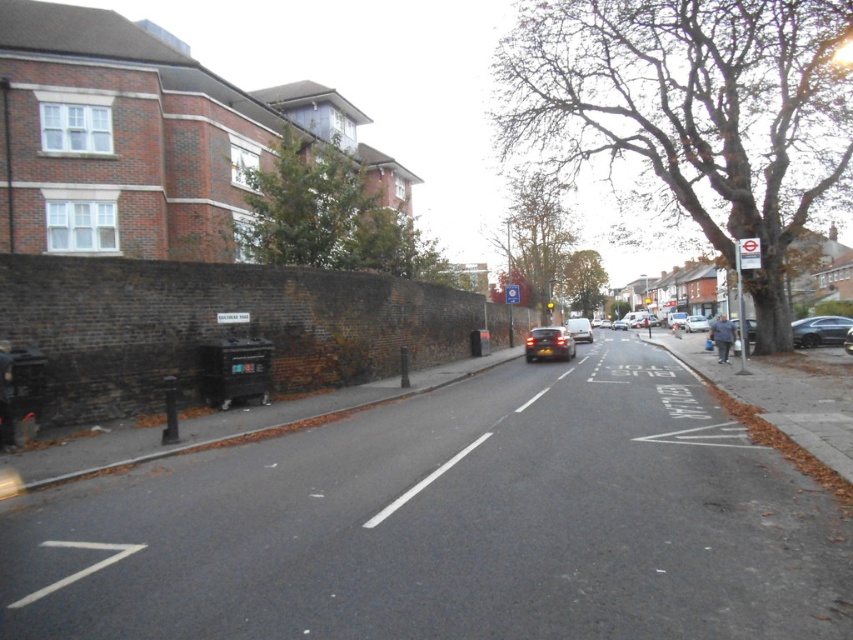
Question: Which of the following is the farthest from the observer?

Choices:
 (A) (697, 324)
 (B) (558, 355)
 (C) (830, 323)
 (D) (753, 260)

Answer: (A)

Question: Which point is farther to the camera?

Choices:
 (A) silver metallic van at center
 (B) metallic silver bus stop sign at right

Answer: (A)

Question: Which of the following is the closest to the observer?

Choices:
 (A) shiny silver car at center
 (B) metallic silver bus stop sign at right
 (C) shiny black car at center

Answer: (B)

Question: Does shiny black car at right have a greater width compared to silver metallic van at center?

Choices:
 (A) no
 (B) yes

Answer: (A)

Question: Is shiny black car at right to the left of metallic silver bus stop sign at right from the viewer's perspective?

Choices:
 (A) no
 (B) yes

Answer: (A)

Question: Does matte silver car at center appear under shiny black car at center?

Choices:
 (A) yes
 (B) no

Answer: (B)